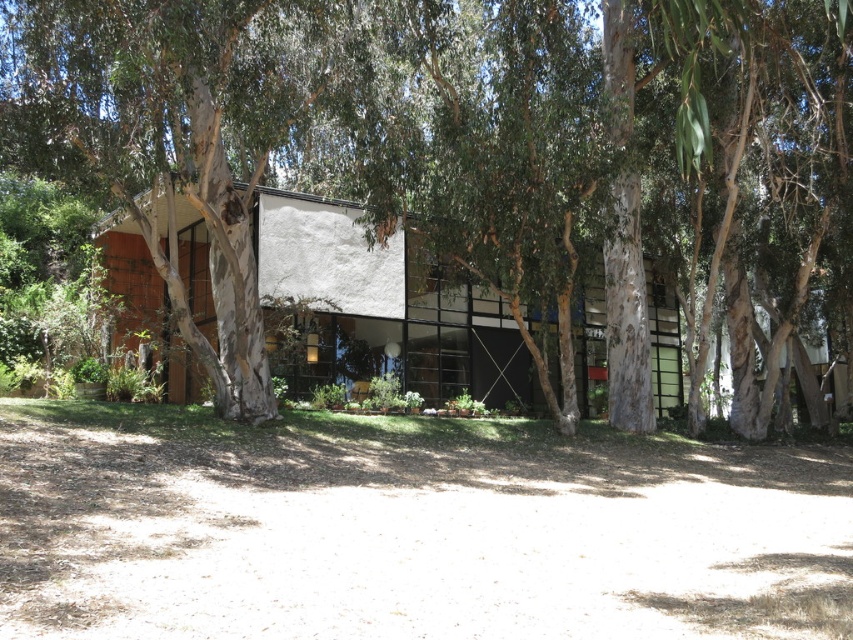
You are a landscape architect designing a new garden for the property. You need to ensure that the white textured tree at center and the white stucco house at center are both visible from the main entrance path. Given their sizes, which object might require strategic placement to avoid blocking the view of the other?

The white textured tree at center is larger in size than the white stucco house at center, so the tree might need to be positioned carefully to prevent it from obstructing the view of the house.

You are standing in front of the white stucco house at center and want to take a photo of the white textured tree at center. To get the tree in the frame, should you move to your left or right?

You should move to your left to capture the white textured tree at center in the frame since it is located to the right of the white stucco house at center, so moving left would bring it into view.

You are a delivery person trying to park your 3.5 meter long delivery van in front of the white stucco house at center. There is a white textured tree at center nearby. Is there enough space between the tree and the house to park your van?

The distance between the white textured tree at center and the white stucco house at center is 5.11 meters. Since the van is 3.5 meters long, there is sufficient space to park between them as 5.11 meters is greater than 3.5 meters.